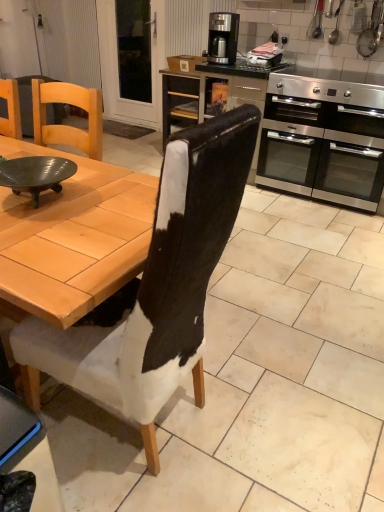
The image size is (384, 512). I want to click on spots to the right of black leather chair at center, so click(267, 417).